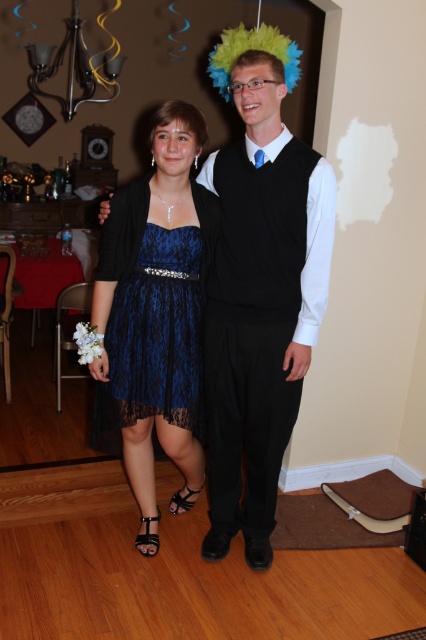
You are a photographer at a prom event and need to arrange two dresses for a photo shoot. The navy lace dress at center and the lace blue dress at center are available. If you want to place the larger dress on the left side of the frame, which dress should you choose?

The navy lace dress at center is bigger than the lace blue dress at center, so you should choose the navy lace dress at center to place on the left side of the frame as the larger dress.

Based on the coordinates provided, can you identify which object corresponds to the point at (259, 288)?

The point at (259, 288) corresponds to the blue lace dress at center.

You are a photographer at a prom event and need to position the two dresses properly. The blue lace dress at center and the navy lace dress at center must be arranged so that the larger one is placed in the foreground to avoid being overshadowed by the background. Which dress should you place in the foreground?

The blue lace dress at center is larger in size than the navy lace dress at center, so you should place the blue lace dress at center in the foreground to ensure it isn